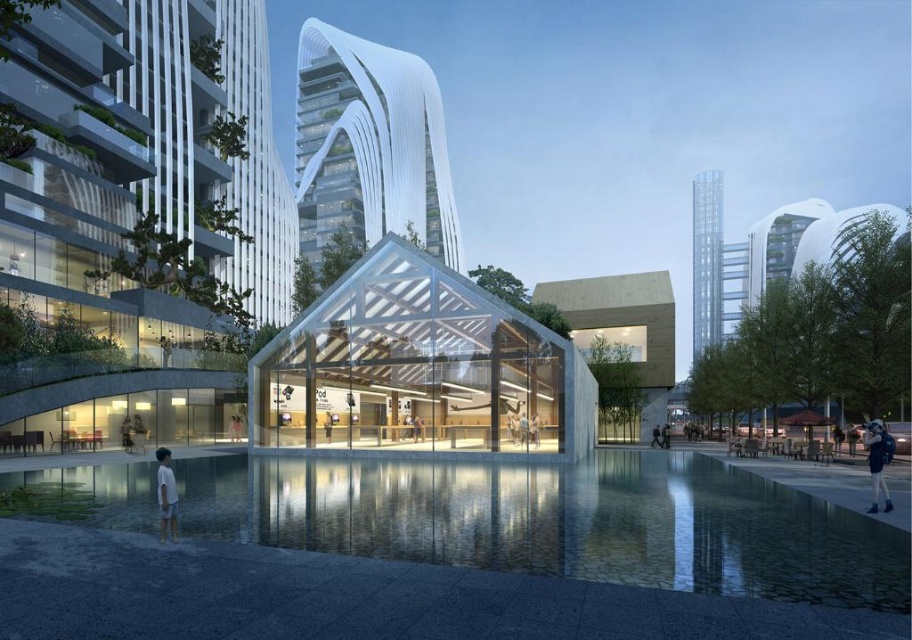
You are an architect analyzing the urban layout. In the image, you observe the white glass tower at upper center and the denim jacket at lower right. Which of these two objects is positioned higher in the scene?

The white glass tower at upper center is located above the denim jacket at lower right, so it is positioned higher in the scene.

You are standing in the modern urban landscape and want to take a photo of the white glass tower at upper center. If your camera can focus on objects up to 60 meters away, will you need to move closer to get a clear shot?

The white glass tower at upper center is 63.82 meters away from you. Since your camera can only focus up to 60 meters, you need to move closer to ensure the white glass tower at upper center is within the camera range.